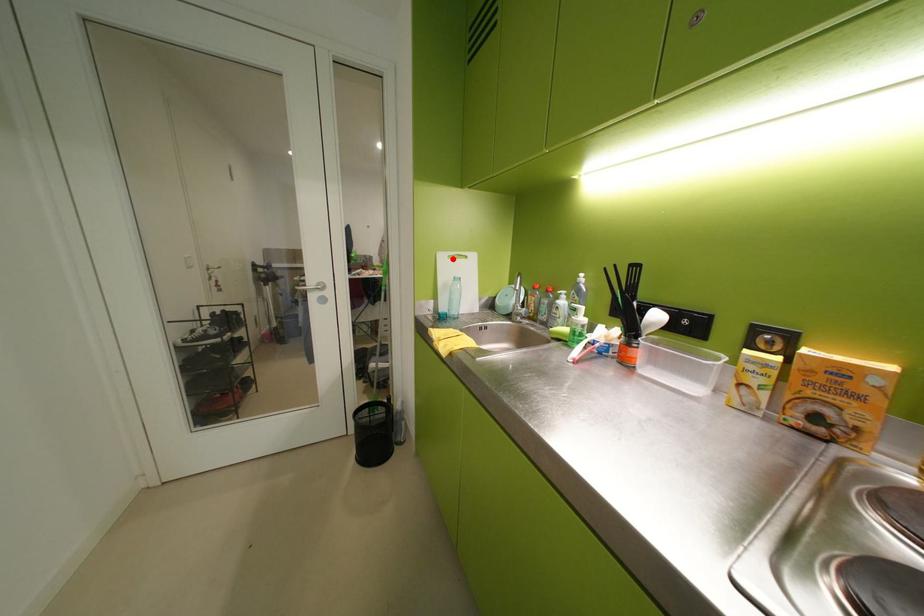
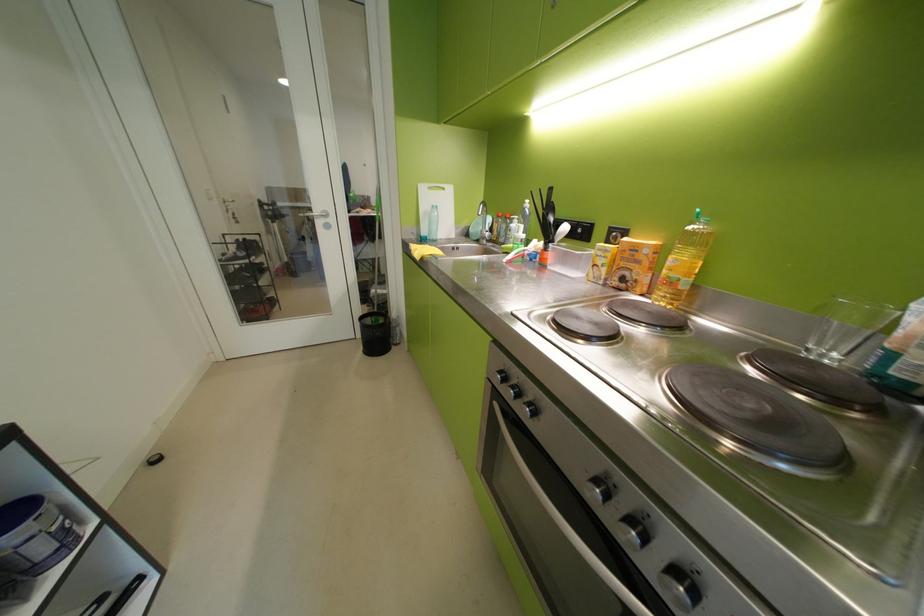
Question: I am providing you with two images of the same scene from different viewpoints. Given a red point in image1, look at the same physical point in image2. Is it:

Choices:
 (A) Closer to the viewpoint
 (B) Farther from the viewpoint

Answer: (A)